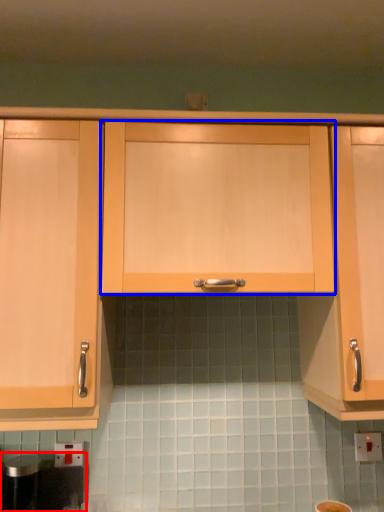
Question: Which object appears farthest to the camera in this image, appliance (highlighted by a red box) or cabinetry (highlighted by a blue box)?

Choices:
 (A) appliance
 (B) cabinetry

Answer: (A)